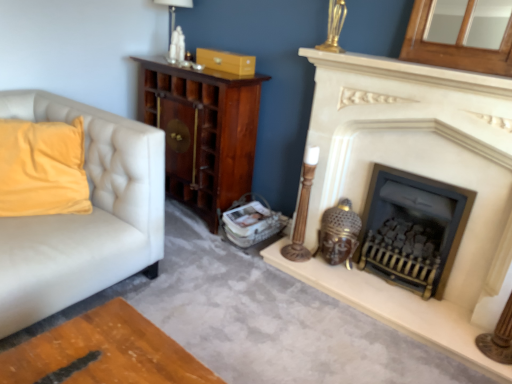
What are the coordinates of `free space in front of dark wood cabinet at center` in the screenshot? It's located at (197, 244).